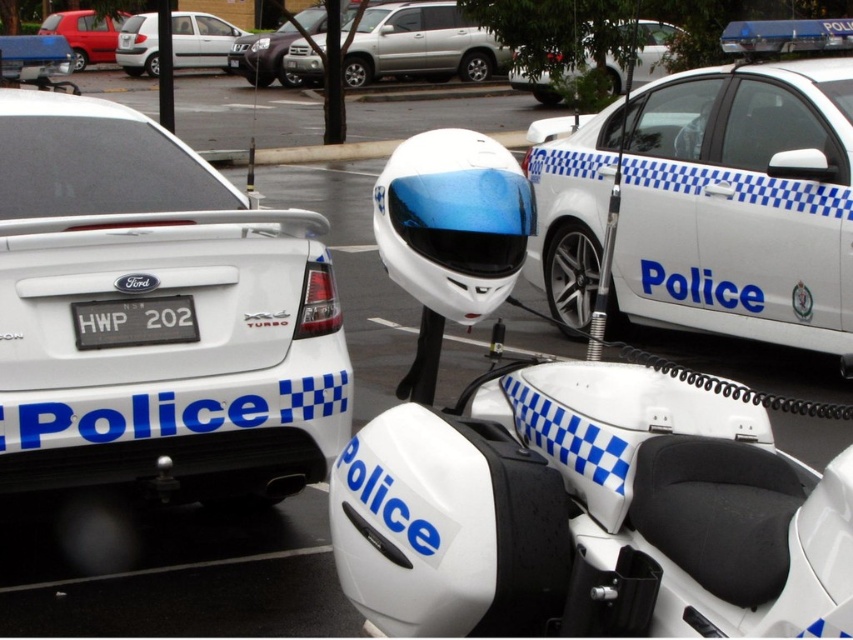
In the scene shown: You are standing in the parking lot and want to know which point is nearer to you. The points are point (424, 45) and point (247, 74). Which one is closer?

Point (424, 45) is closer to the viewer than point (247, 74).